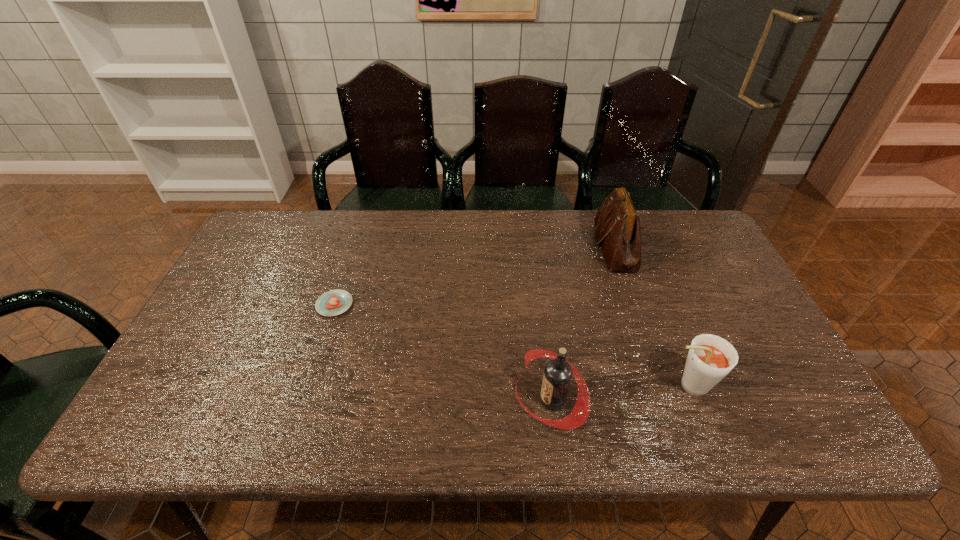
Locate an element on the screen. This screenshot has width=960, height=540. free space at the near right corner is located at coordinates (818, 435).

Locate an element on the screen. Image resolution: width=960 pixels, height=540 pixels. vacant space in between the right root beer and the second object from left to right is located at coordinates (620, 393).

You are a GUI agent. You are given a task and a screenshot of the screen. Output one action in this format:
    pyautogui.click(x=<x>, y=<y>)
    Task: Click on the vacant region between the third object from right to left and the right root beer
    The width and height of the screenshot is (960, 540).
    Given the screenshot: What is the action you would take?
    pyautogui.click(x=620, y=393)

Locate an element on the screen. The height and width of the screenshot is (540, 960). free spot between the third object from right to left and the shoulder bag is located at coordinates (583, 323).

In order to click on empty location between the right root beer and the left root beer in this screenshot , I will do `click(620, 393)`.

Locate an element on the screen. The width and height of the screenshot is (960, 540). vacant region between the leftmost object and the right root beer is located at coordinates (511, 345).

The height and width of the screenshot is (540, 960). In order to click on vacant area that lies between the farthest object and the leftmost object in this screenshot , I will do `click(474, 275)`.

You are a GUI agent. You are given a task and a screenshot of the screen. Output one action in this format:
    pyautogui.click(x=<x>, y=<y>)
    Task: Click on the vacant point located between the left root beer and the shortest object
    The width and height of the screenshot is (960, 540).
    Given the screenshot: What is the action you would take?
    pos(444,353)

The width and height of the screenshot is (960, 540). I want to click on empty location between the shortest object and the right root beer, so click(x=511, y=345).

Find the location of a particular element. free space between the leftmost object and the farthest object is located at coordinates (474, 275).